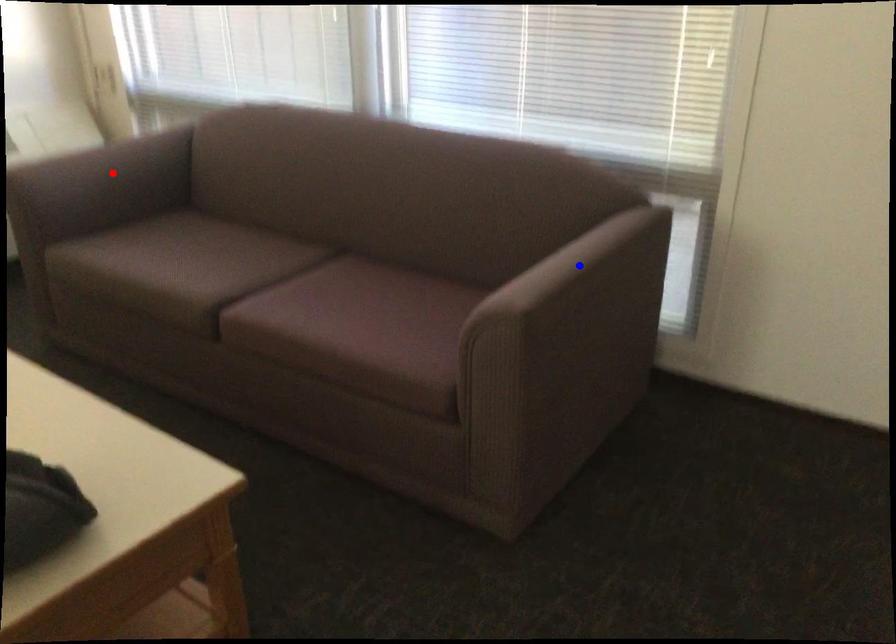
Question: Which of the two points in the image is closer to the camera?

Choices:
 (A) Blue point is closer.
 (B) Red point is closer.

Answer: (A)